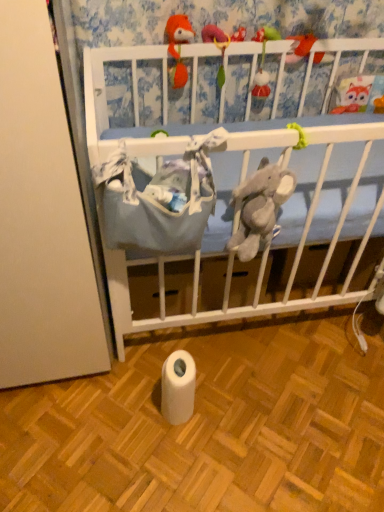
Identify the location of vacant space in front of white matte toilet paper at lower center. (179, 466).